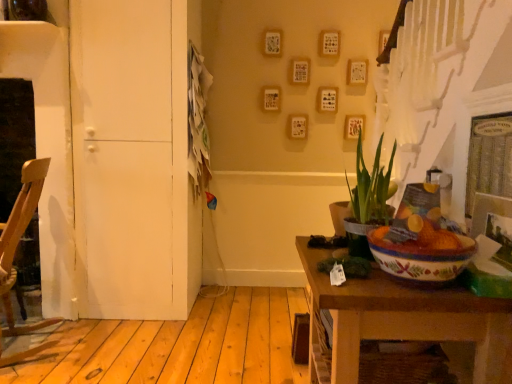
Find the location of `vacant region under wooden chair at left (from a real-world perspective)`. vacant region under wooden chair at left (from a real-world perspective) is located at coordinates (26, 345).